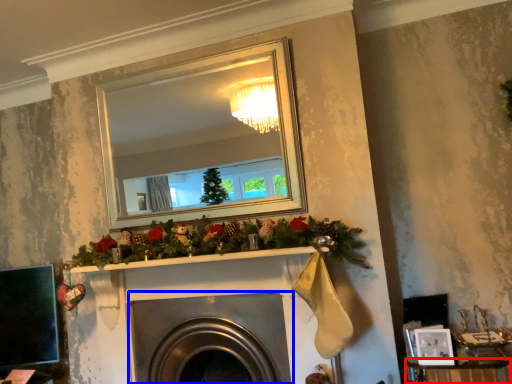
Question: Among these objects, which one is farthest to the camera, furniture (highlighted by a red box) or fireplace (highlighted by a blue box)?

Choices:
 (A) furniture
 (B) fireplace

Answer: (B)